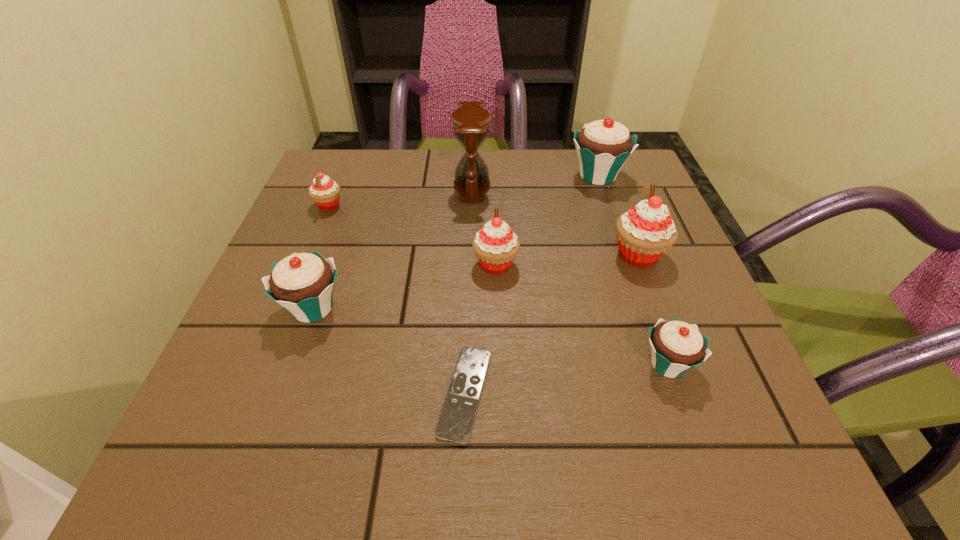
Where is `hourglass`? Image resolution: width=960 pixels, height=540 pixels. hourglass is located at coordinates [471, 122].

This screenshot has width=960, height=540. I want to click on the biggest teal cupcake, so click(x=603, y=146).

Image resolution: width=960 pixels, height=540 pixels. Identify the location of the farthest teal cupcake. (603, 146).

Locate an element on the screen. the biggest pink cupcake is located at coordinates (644, 233).

I want to click on the second smallest pink cupcake, so click(x=495, y=245).

You are a GUI agent. You are given a task and a screenshot of the screen. Output one action in this format:
    pyautogui.click(x=<x>, y=<y>)
    Task: Click on the second pink cupcake from left to right
    
    Given the screenshot: What is the action you would take?
    pyautogui.click(x=495, y=245)

The height and width of the screenshot is (540, 960). What are the coordinates of `the second nearest teal cupcake` in the screenshot? It's located at (303, 283).

Image resolution: width=960 pixels, height=540 pixels. Find the location of `the fifth farthest cupcake`. the fifth farthest cupcake is located at coordinates (303, 283).

This screenshot has height=540, width=960. What are the coordinates of `the smallest pink cupcake` in the screenshot? It's located at (325, 192).

What are the coordinates of `the leftmost pink cupcake` in the screenshot? It's located at (325, 192).